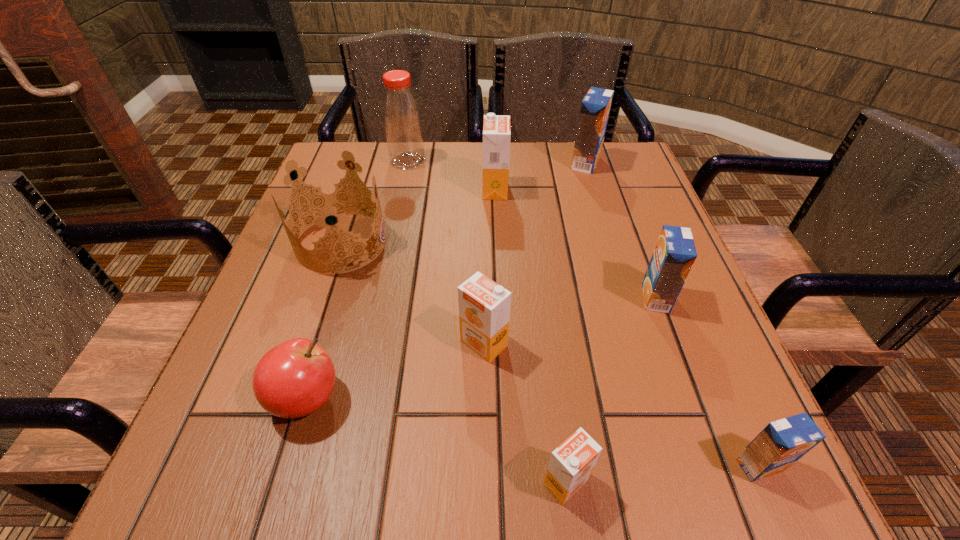
You are a GUI agent. You are given a task and a screenshot of the screen. Output one action in this format:
    pyautogui.click(x=<x>, y=<y>)
    Task: Click on the bottle
    
    Given the screenshot: What is the action you would take?
    pyautogui.click(x=401, y=114)

This screenshot has width=960, height=540. I want to click on the tallest object, so click(x=401, y=114).

This screenshot has height=540, width=960. I want to click on the farthest blue orange_juice, so click(595, 107).

The image size is (960, 540). In order to click on the farthest orange juice in this screenshot , I will do `click(595, 107)`.

Identify the location of the second farthest orange juice. Image resolution: width=960 pixels, height=540 pixels. (496, 128).

In order to click on the seventh nearest object in this screenshot , I will do `click(496, 128)`.

The height and width of the screenshot is (540, 960). In order to click on crown in this screenshot , I will do `click(328, 202)`.

Locate an element on the screen. The width and height of the screenshot is (960, 540). the second smallest blue orange_juice is located at coordinates (674, 255).

The height and width of the screenshot is (540, 960). Find the location of `the fifth farthest object`. the fifth farthest object is located at coordinates (674, 255).

Image resolution: width=960 pixels, height=540 pixels. Identify the location of the third nearest orange juice. (484, 306).